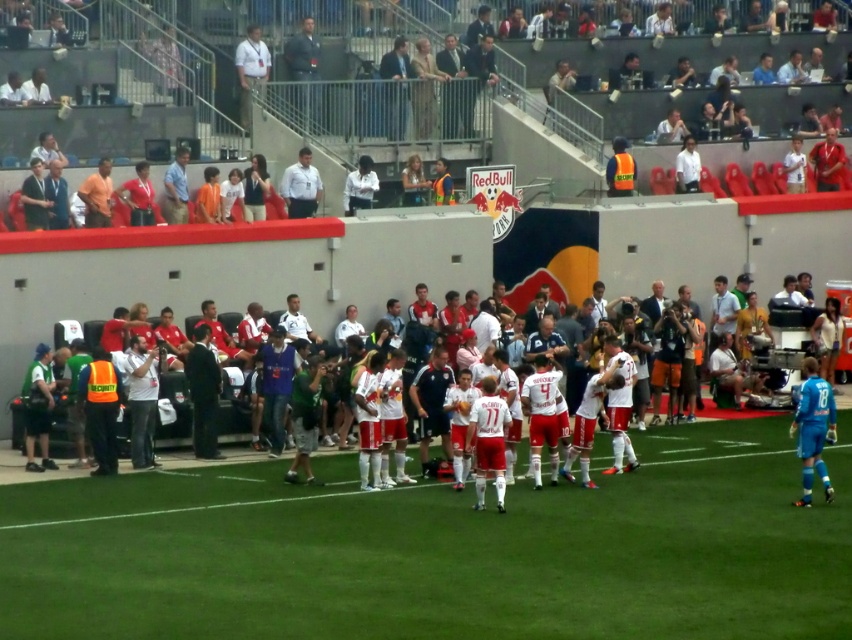
You are standing at the edge of the soccer field and want to throw a ball to a friend. You have two points marked on the field where you can aim. The first point is at coordinate point(492,465) and the second point is at coordinate point(608,161). Which point should you aim for if you want the ball to land closer to you?

You should aim for point(492,465) because it is closer to the viewer than point(608,161).

You are a photographer positioned at the edge of the soccer field. You want to capture a closeup shot of the white jersey at center. Given that your camera has a maximum zoom range of 20 meters, can you achieve this without moving closer?

The white jersey at center is 23.80 meters away from the viewer. Since the camera can only zoom up to 20 meters, you cannot achieve a closeup shot without moving closer.